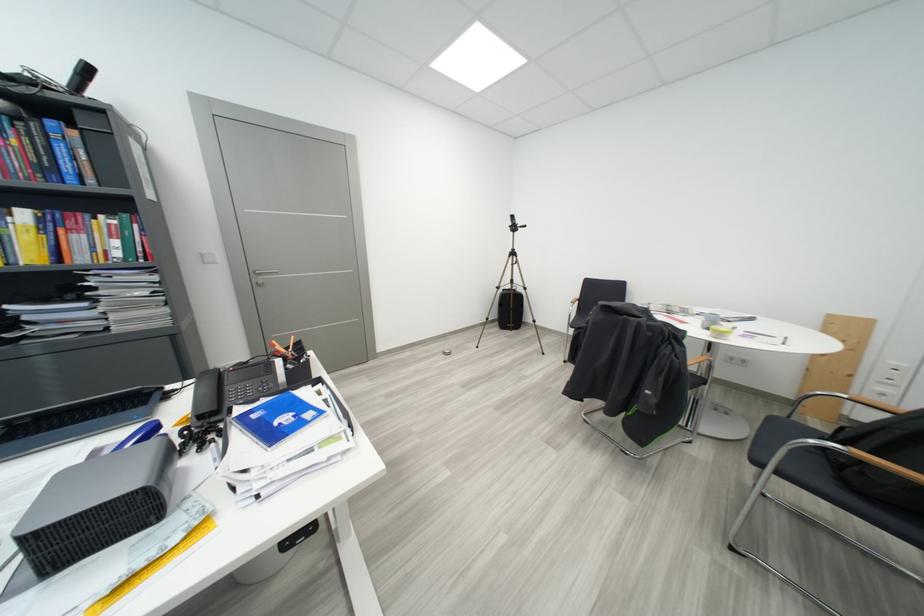
Which object does [509,309] point to?

It corresponds to the black camera bag in the image.